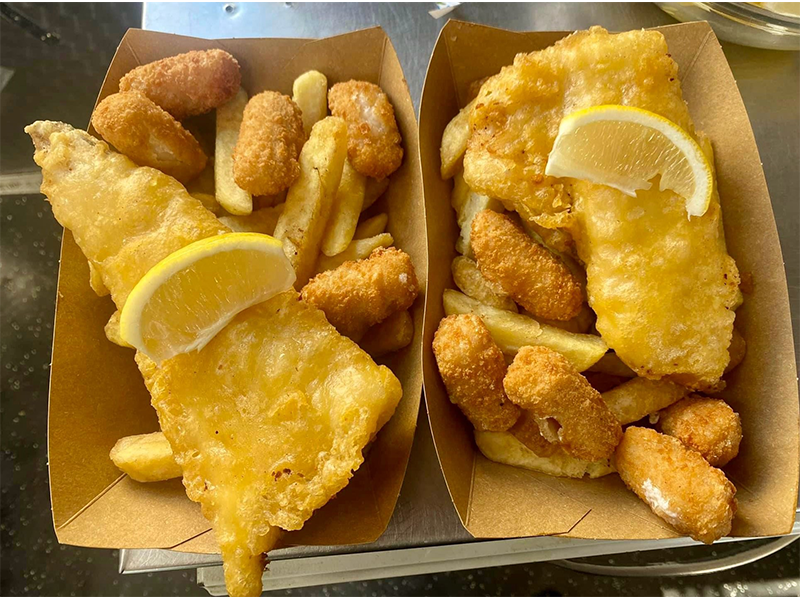
Locate an element on the screen. table is located at coordinates (773, 106), (406, 39).